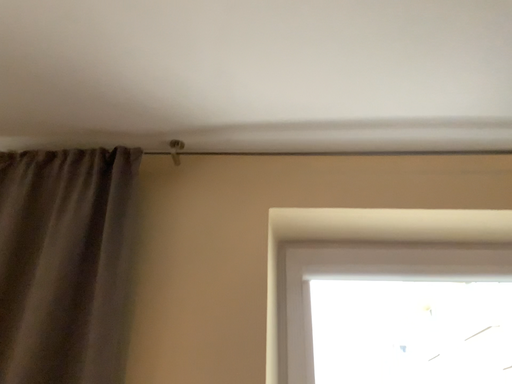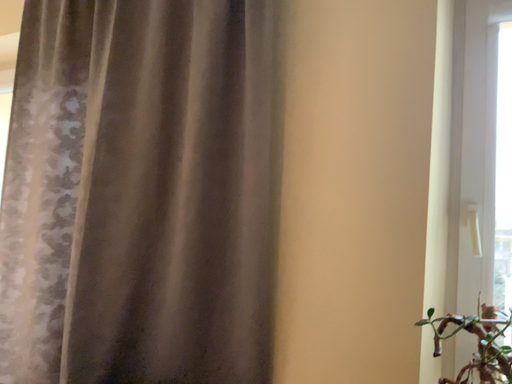
Question: How did the camera likely rotate when shooting the video?

Choices:
 (A) rotated left
 (B) rotated right

Answer: (A)